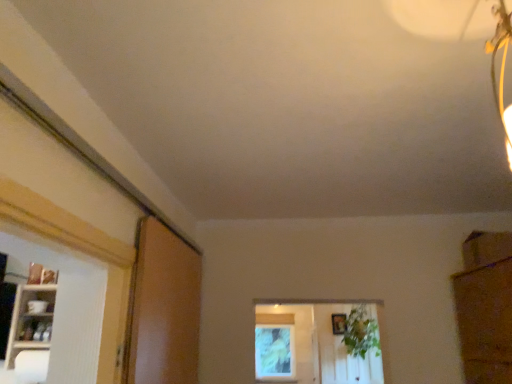
Question: Is white glossy shelf at left oriented towards green leafy plant at center?

Choices:
 (A) yes
 (B) no

Answer: (B)

Question: Can green leafy plant at center be found inside white glossy shelf at left?

Choices:
 (A) yes
 (B) no

Answer: (B)

Question: Is white glossy shelf at left at the left side of green leafy plant at center?

Choices:
 (A) no
 (B) yes

Answer: (B)

Question: Are white glossy shelf at left and green leafy plant at center located far from each other?

Choices:
 (A) no
 (B) yes

Answer: (B)

Question: Is white glossy shelf at left next to green leafy plant at center?

Choices:
 (A) yes
 (B) no

Answer: (B)

Question: Considering the positions of brown matte screen door at left and wooden picture frame at center in the image, is brown matte screen door at left taller or shorter than wooden picture frame at center?

Choices:
 (A) tall
 (B) short

Answer: (A)

Question: Based on their sizes in the image, would you say brown matte screen door at left is bigger or smaller than wooden picture frame at center?

Choices:
 (A) big
 (B) small

Answer: (A)

Question: Considering the positions of brown matte screen door at left and wooden picture frame at center in the image, is brown matte screen door at left wider or thinner than wooden picture frame at center?

Choices:
 (A) wide
 (B) thin

Answer: (A)

Question: From a real-world perspective, is brown matte screen door at left above or below wooden picture frame at center?

Choices:
 (A) above
 (B) below

Answer: (B)

Question: From a real-world perspective, is wooden picture frame at center physically located above or below white glossy shelf at left?

Choices:
 (A) above
 (B) below

Answer: (A)

Question: Considering the positions of wooden picture frame at center and white glossy shelf at left in the image, is wooden picture frame at center bigger or smaller than white glossy shelf at left?

Choices:
 (A) small
 (B) big

Answer: (A)

Question: Is point (331, 317) positioned closer to the camera than point (18, 292)?

Choices:
 (A) closer
 (B) farther

Answer: (B)

Question: Is wooden picture frame at center spatially inside white glossy shelf at left, or outside of it?

Choices:
 (A) inside
 (B) outside

Answer: (B)

Question: Considering the positions of brown matte screen door at left and green leafy plant at center in the image, is brown matte screen door at left bigger or smaller than green leafy plant at center?

Choices:
 (A) big
 (B) small

Answer: (B)

Question: From a real-world perspective, is brown matte screen door at left above or below green leafy plant at center?

Choices:
 (A) above
 (B) below

Answer: (A)